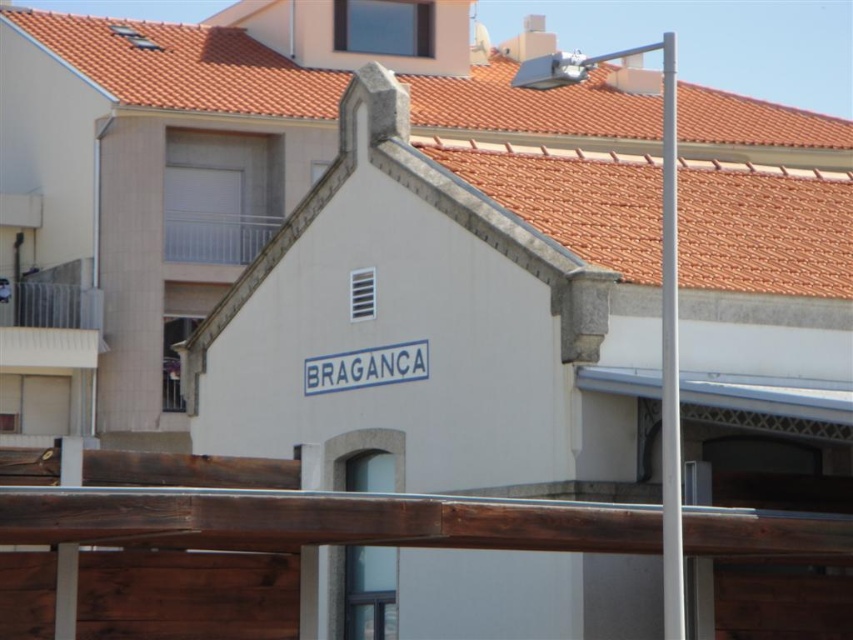
Question: Is brown wooden rail at lower center below white metallic pole at right?

Choices:
 (A) no
 (B) yes

Answer: (B)

Question: Is brown wooden rail at lower center to the right of white metallic pole at right from the viewer's perspective?

Choices:
 (A) yes
 (B) no

Answer: (B)

Question: Which point is farther to the camera?

Choices:
 (A) white metallic pole at right
 (B) brown wooden rail at lower center

Answer: (A)

Question: Which of the following is the closest to the observer?

Choices:
 (A) (674, 145)
 (B) (782, 541)

Answer: (B)

Question: Does brown wooden rail at lower center appear on the right side of white metallic pole at right?

Choices:
 (A) no
 (B) yes

Answer: (A)